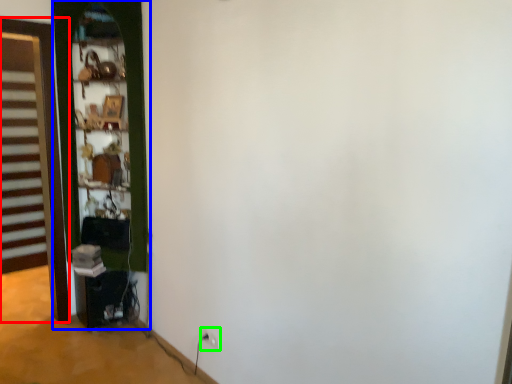
Question: Considering the real-world distances, which object is farthest from door (highlighted by a red box)? door (highlighted by a blue box) or electric outlet (highlighted by a green box)?

Choices:
 (A) door
 (B) electric outlet

Answer: (B)